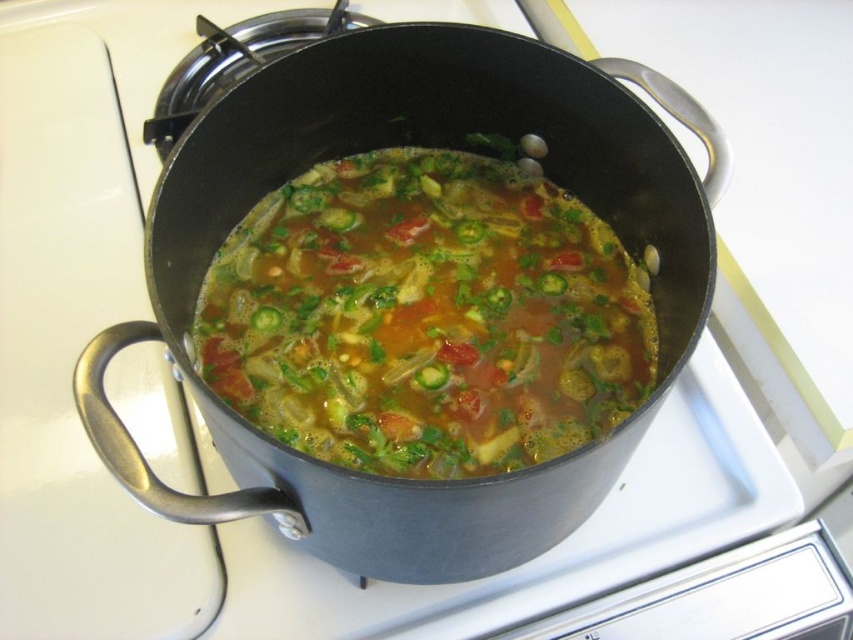
The width and height of the screenshot is (853, 640). What do you see at coordinates (415, 144) in the screenshot? I see `black matte pot at center` at bounding box center [415, 144].

Does black matte pot at center appear on the right side of brown glossy soup at center?

Incorrect, black matte pot at center is not on the right side of brown glossy soup at center.

Between point (283, 492) and point (479, 326), which one is positioned behind?

Positioned behind is point (479, 326).

The image size is (853, 640). Find the location of `black matte pot at center`. black matte pot at center is located at coordinates (415, 144).